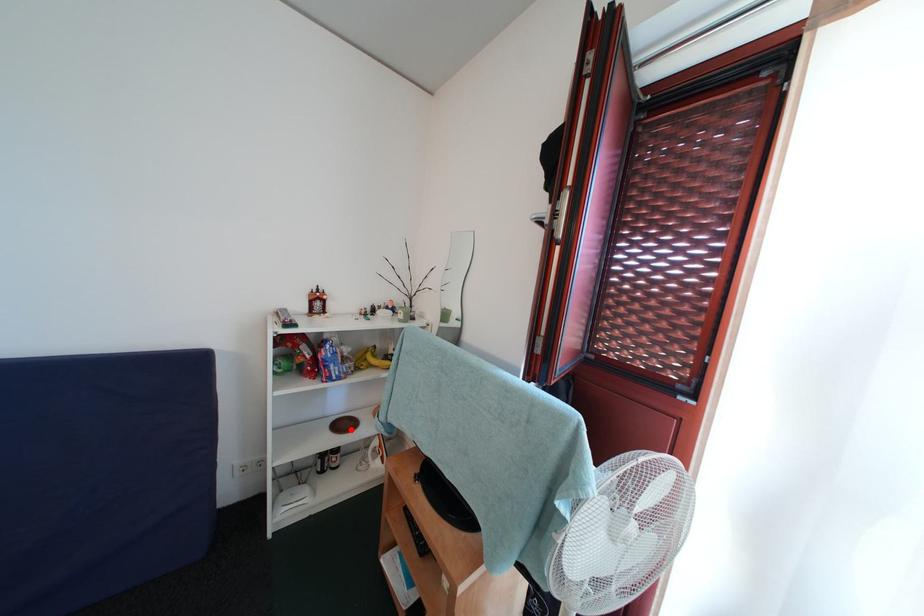
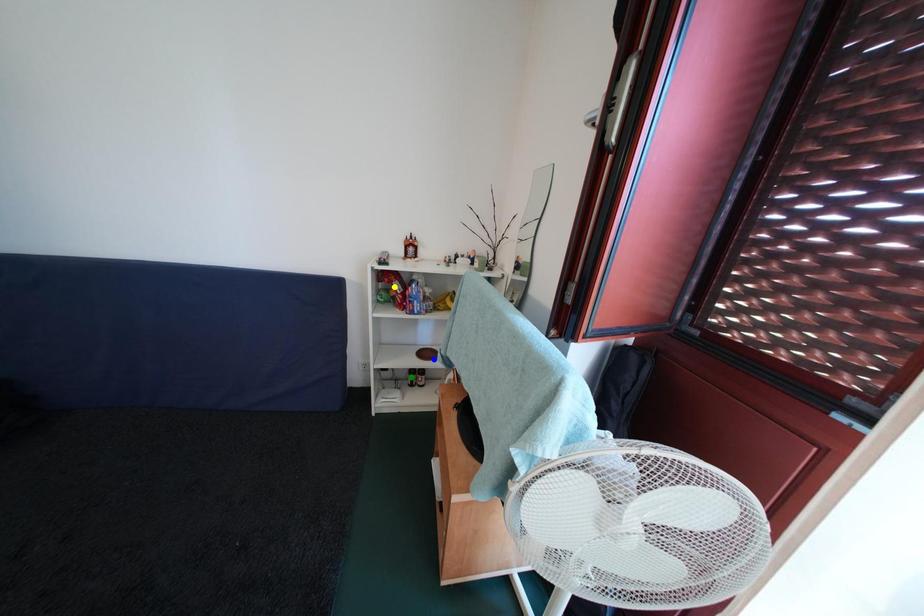
Question: I am providing you with two images of the same scene from different viewpoints. A red point is marked on the first image. You are given multiple points on the second image. Which mark in image 2 goes with the point in image 1?

Choices:
 (A) green point
 (B) blue point
 (C) yellow point

Answer: (B)